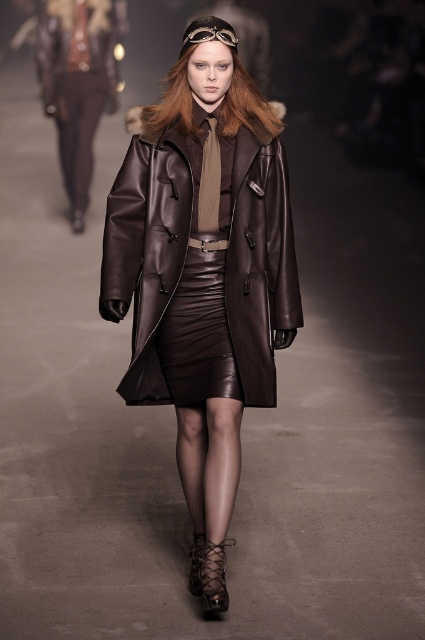
Based on the photo, you are a fashion designer observing the runway show. You need to determine the material of the pants located at point (78, 83). What is the material?

The material at point (78, 83) is matte leather pants.

You are a fashion designer observing the runway show and notice the matte leather trench coat at center and the matte leather pants at center. Which piece of clothing is taller?

The matte leather trench coat at center is taller than the matte leather pants at center.